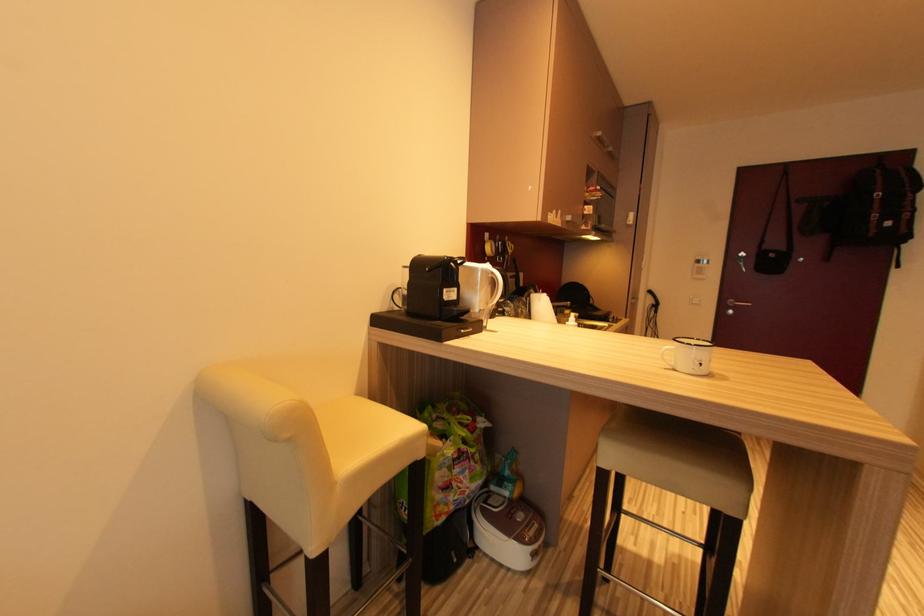
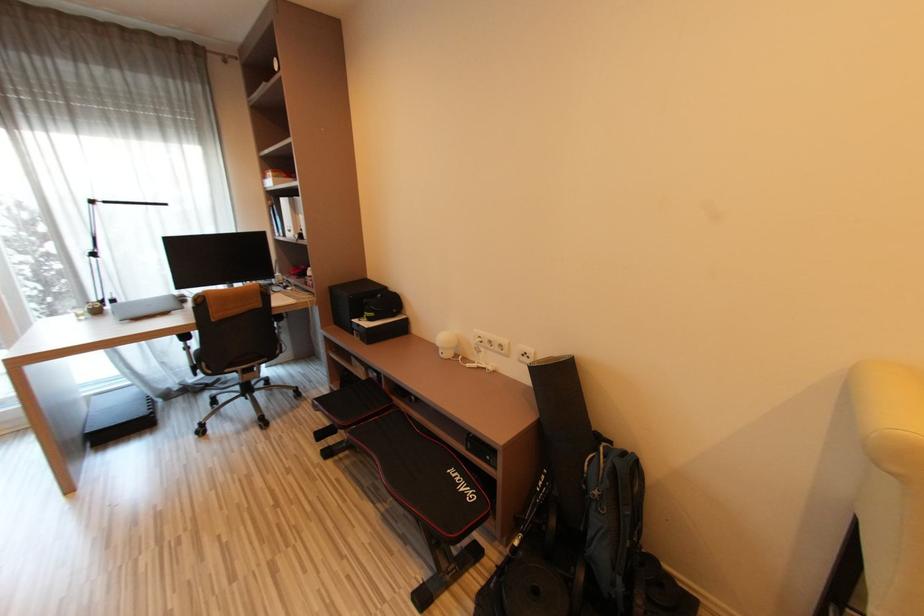
First-person continuous shooting, in which direction is the camera rotating?

The camera's rotation is toward left-down.